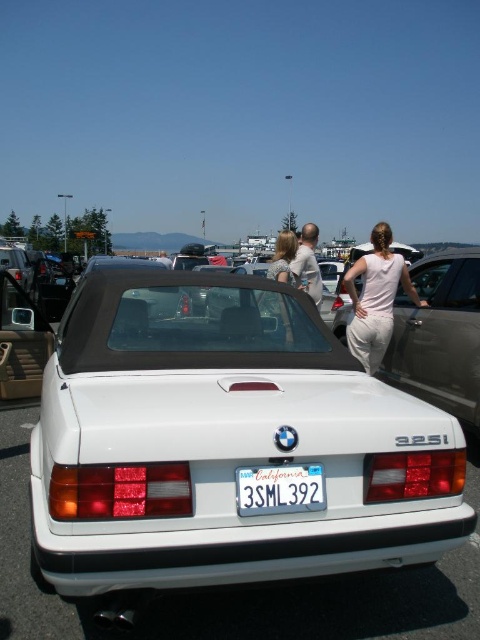
Consider the image. You are a photographer standing in the parking lot and want to take a photo of the light beige fabric shirt at center without the white glossy sedan at center blocking it. What should you do?

The light beige fabric shirt at center is behind the white glossy sedan at center, so you should move to a position where the sedan is no longer between you and the shirt or adjust your angle to frame the shirt around the car.

You are a pedestrian standing in front of the white BMW 325i. You notice both the white plastic license plate at center and the matte beige dress at center. Which object is positioned to the right when viewed from the front of the car?

The matte beige dress at center is positioned to the right of the white plastic license plate at center.

You are standing at the point with coordinates (225,442) in the parking lot. What object is directly in front of you?

The point at coordinates (225,442) indicates the white matte sedan at center, so the white matte sedan at center is directly in front of you.